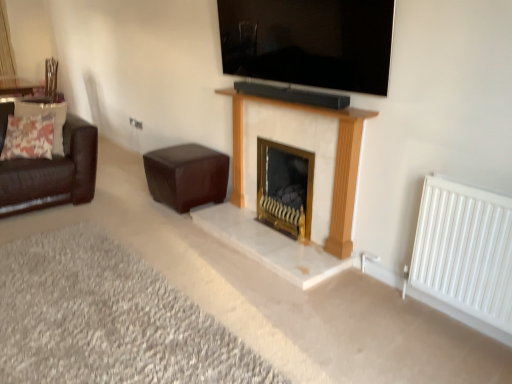
Question: Does white fabric curtain at upper left have a lesser height compared to white marble fireplace at center?

Choices:
 (A) no
 (B) yes

Answer: (A)

Question: Is white fabric curtain at upper left directly adjacent to white marble fireplace at center?

Choices:
 (A) yes
 (B) no

Answer: (B)

Question: Is white marble fireplace at center located within white fabric curtain at upper left?

Choices:
 (A) no
 (B) yes

Answer: (A)

Question: Considering the relative sizes of white fabric curtain at upper left and white marble fireplace at center in the image provided, is white fabric curtain at upper left smaller than white marble fireplace at center?

Choices:
 (A) yes
 (B) no

Answer: (A)

Question: Does white fabric curtain at upper left have a larger size compared to white marble fireplace at center?

Choices:
 (A) no
 (B) yes

Answer: (A)

Question: Does white fabric curtain at upper left have a greater height compared to white marble fireplace at center?

Choices:
 (A) yes
 (B) no

Answer: (A)

Question: Does brown leather stool at center lie behind white fabric curtain at upper left?

Choices:
 (A) yes
 (B) no

Answer: (B)

Question: Does brown leather stool at center have a lesser width compared to white fabric curtain at upper left?

Choices:
 (A) no
 (B) yes

Answer: (A)

Question: Is white fabric curtain at upper left at the back of brown leather stool at center?

Choices:
 (A) no
 (B) yes

Answer: (A)

Question: Are brown leather stool at center and white fabric curtain at upper left far apart?

Choices:
 (A) no
 (B) yes

Answer: (B)

Question: Is brown leather stool at center shorter than white fabric curtain at upper left?

Choices:
 (A) no
 (B) yes

Answer: (B)

Question: From the image's perspective, is brown leather stool at center on top of white fabric curtain at upper left?

Choices:
 (A) yes
 (B) no

Answer: (B)

Question: Considering the relative positions of white fabric curtain at upper left and white metal radiator at right in the image provided, is white fabric curtain at upper left behind white metal radiator at right?

Choices:
 (A) no
 (B) yes

Answer: (B)